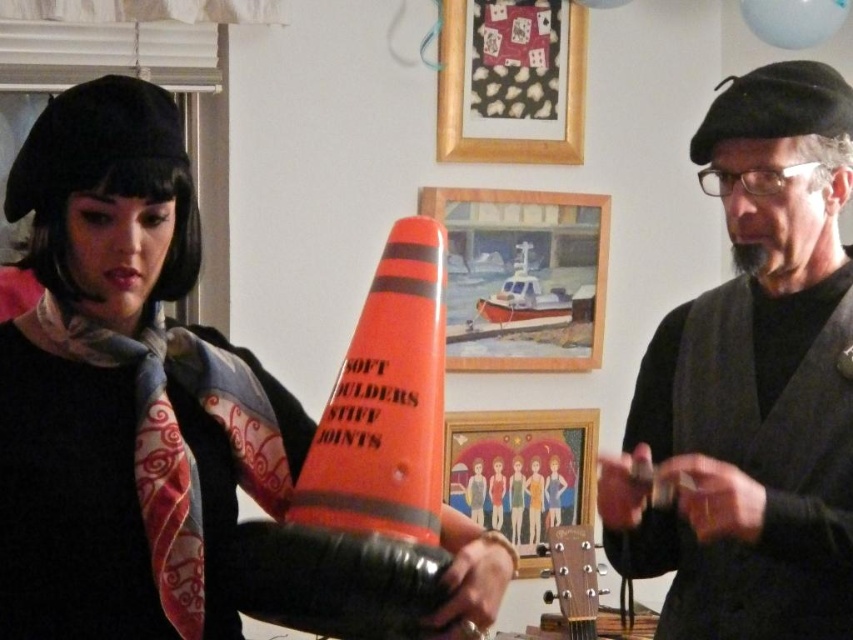
Is matte black beret at upper right below orange reflective cone at center?

No.

This screenshot has height=640, width=853. What do you see at coordinates (753, 384) in the screenshot? I see `matte black beret at upper right` at bounding box center [753, 384].

You are a GUI agent. You are given a task and a screenshot of the screen. Output one action in this format:
    pyautogui.click(x=<x>, y=<y>)
    Task: Click on the matte black beret at upper right
    
    Given the screenshot: What is the action you would take?
    pyautogui.click(x=753, y=384)

Can you confirm if matte black cone at center is positioned above matte black beret at upper right?

Incorrect, matte black cone at center is not positioned above matte black beret at upper right.

The width and height of the screenshot is (853, 640). In order to click on matte black cone at center in this screenshot , I will do `click(123, 388)`.

Does point (381, 342) come closer to viewer compared to point (564, 449)?

Yes.

Between orange reflective cone at center and matte orange cone at center, which one has more height?

Standing taller between the two is orange reflective cone at center.

The width and height of the screenshot is (853, 640). What do you see at coordinates (386, 403) in the screenshot? I see `orange reflective cone at center` at bounding box center [386, 403].

Where is `orange reflective cone at center`? The height and width of the screenshot is (640, 853). orange reflective cone at center is located at coordinates (386, 403).